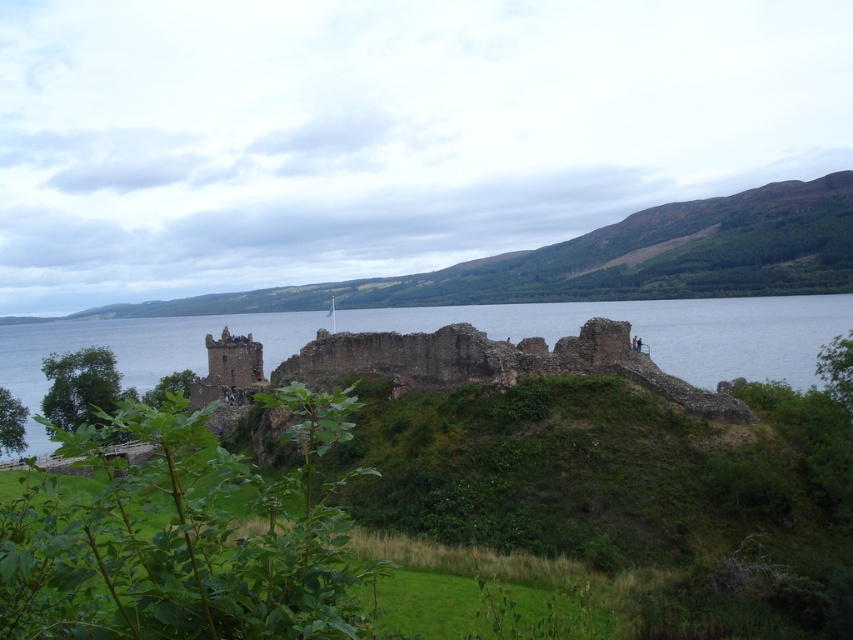
Does green grassy hillside at upper center have a larger size compared to brown stone ruins at center?

No.

Which is behind, point (711, 227) or point (134, 337)?

The point (711, 227) is behind.

Does point (351, 285) lie in front of point (703, 376)?

No, it is behind (703, 376).

Identify the location of green grassy hillside at upper center. (608, 260).